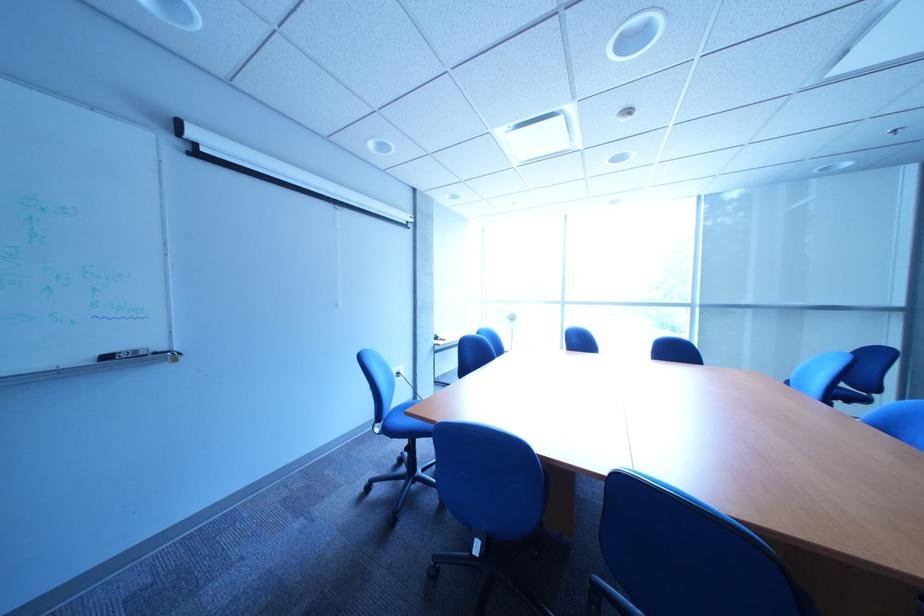
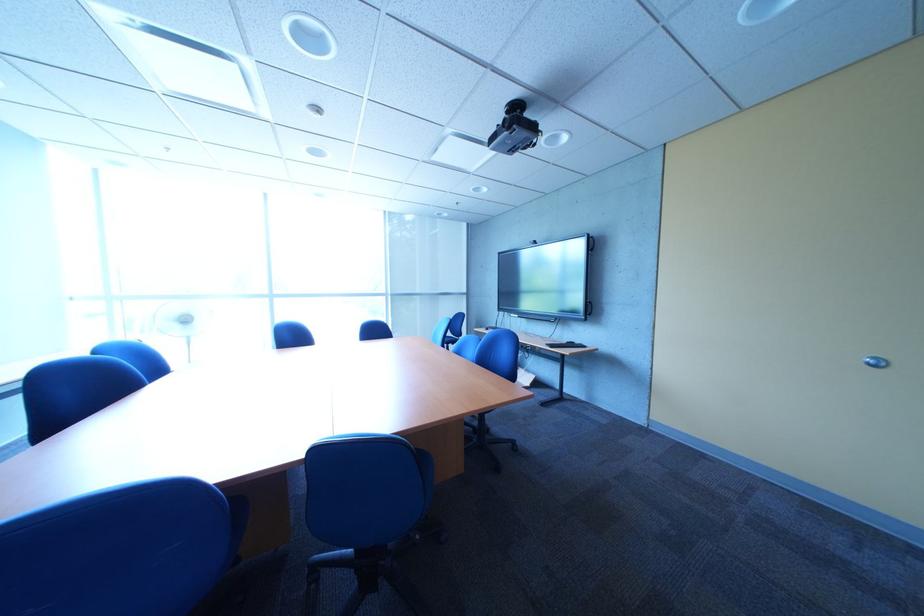
Question: The camera is either moving clockwise (left) or counter-clockwise (right) around the object. The first image is from the beginning of the video and the second image is from the end. Is the camera moving left or right when shooting the video?

Choices:
 (A) Left
 (B) Right

Answer: (A)